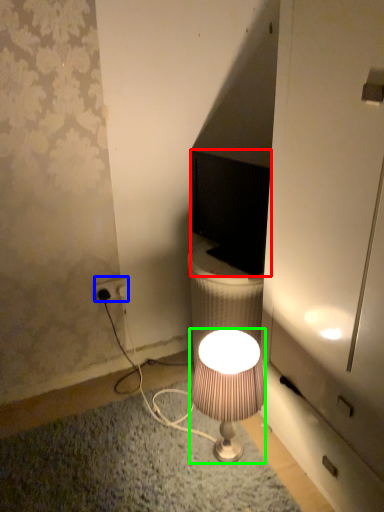
Question: Which object is positioned farthest from computer monitor (highlighted by a red box)? Select from power outlet (highlighted by a blue box) and lamp (highlighted by a green box).

Choices:
 (A) power outlet
 (B) lamp

Answer: (A)